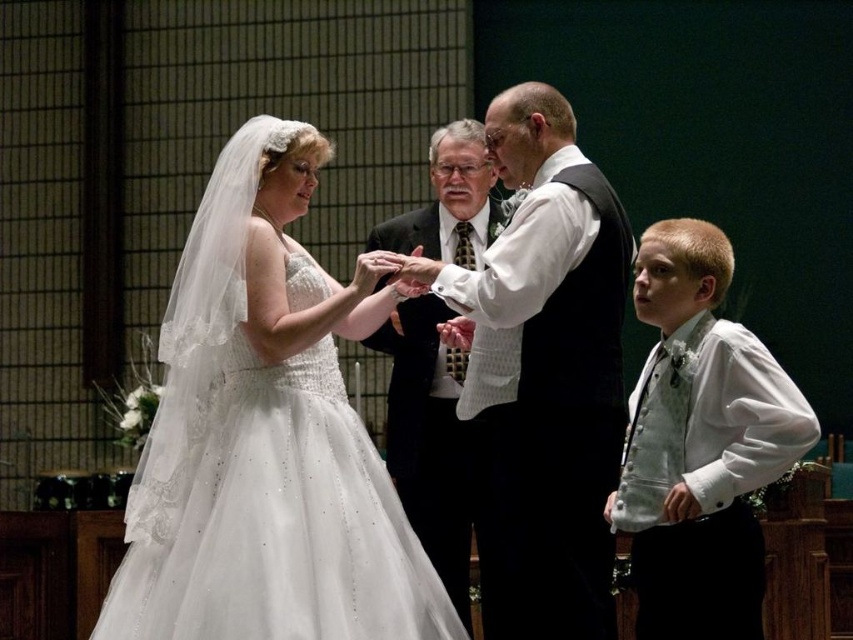
Based on the photo, you are standing at the point labeled as point [389,621] in the image. The officiant is standing 10 feet away from you. Can you determine if the officiant is closer to you or to the groom?

The officiant is 10 feet away from you at point [389,621]. Since the distance between you and the officiant is 10 feet, and the distance between you and the viewer is 102.70 feet, the officiant is closer to you than to the viewer.

You are standing at the back of the church and want to walk to the point labeled as point [465,132]. There is an obstacle at point [712,532]. Will you encounter the obstacle before reaching your destination?

Yes, you will encounter the obstacle at point [712,532] before reaching your destination at point [465,132] because point [712,532] is in front of point [465,132] from your starting position at the back of the church.

Based on the scene description, which object is placed lower in the image between the white satin dress at center and the matte black suit at center?

The white satin dress at center is positioned under the matte black suit at center, so it is placed lower in the image.